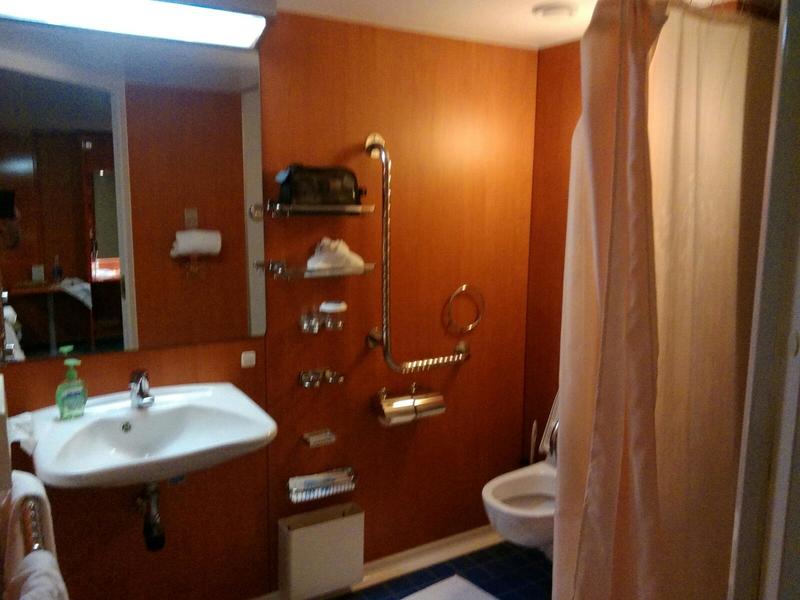
Where is `liquid hand soap`? The height and width of the screenshot is (600, 800). liquid hand soap is located at coordinates (65, 396).